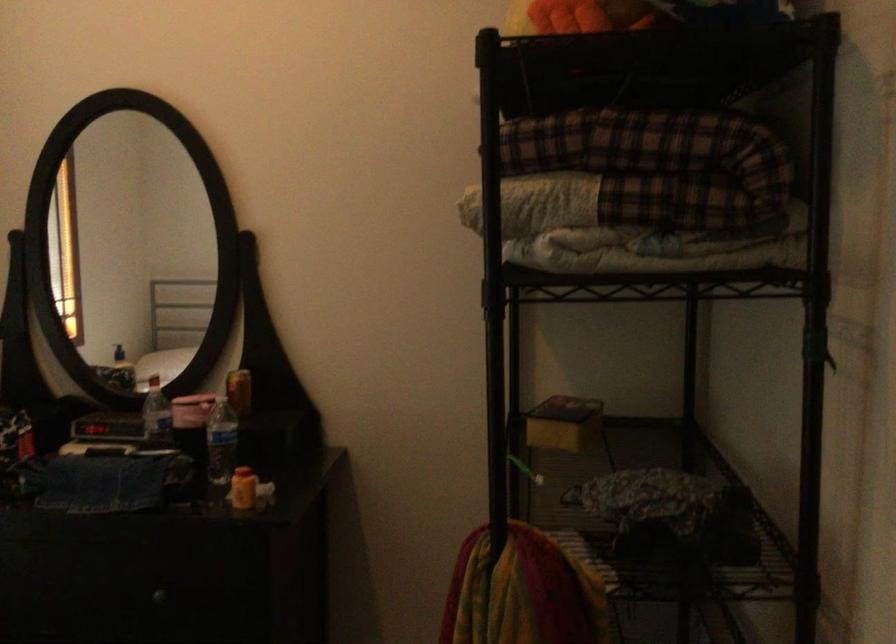
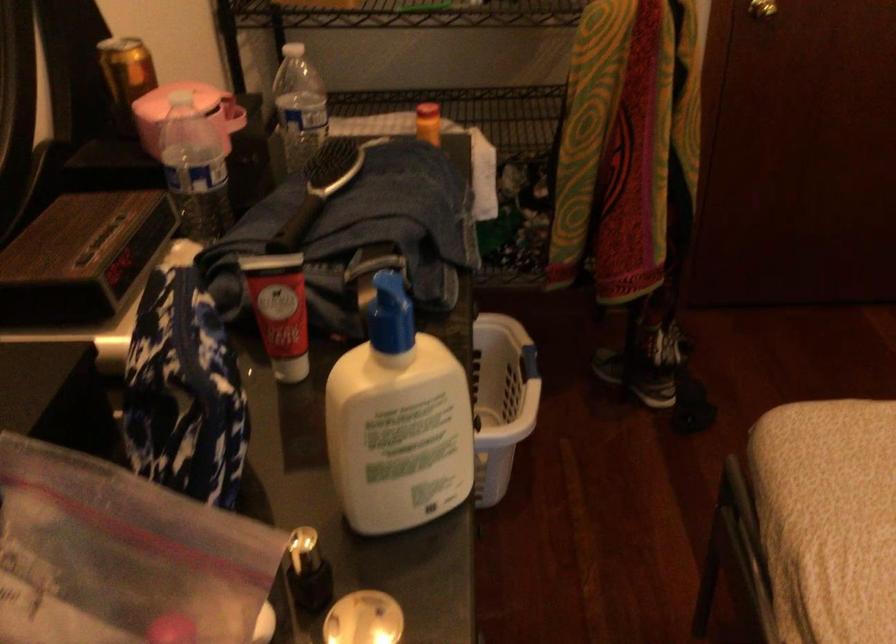
Locate, in the second image, the point that corresponds to point (152, 444) in the first image.

(337, 164)